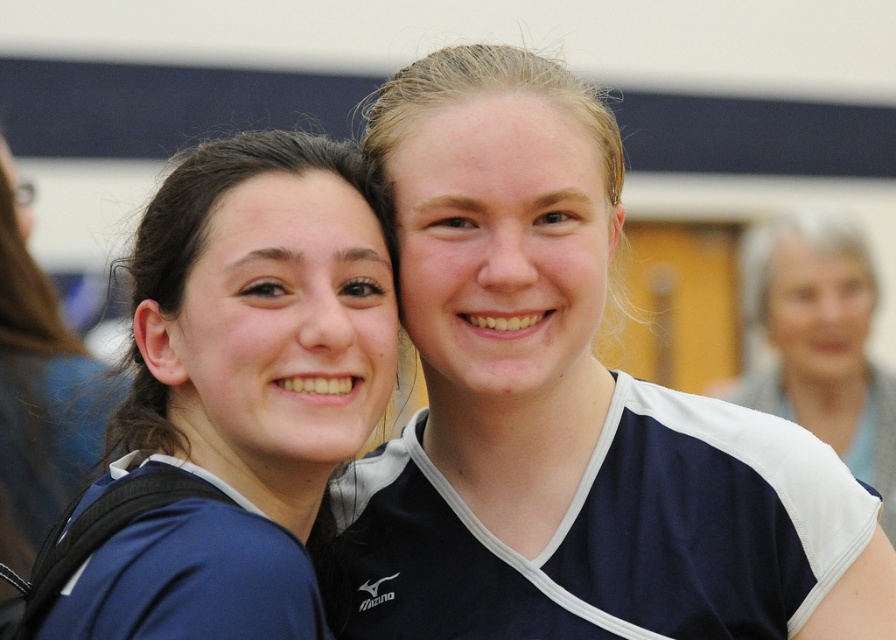
Question: Does blue jersey at left appear over blue jersey at upper right?

Choices:
 (A) yes
 (B) no

Answer: (B)

Question: Where is blue jersey at left located in relation to matte blue jersey at left in the image?

Choices:
 (A) left
 (B) right

Answer: (B)

Question: Which is farther from the blue jersey at upper right?

Choices:
 (A) matte blue jersey at left
 (B) blue jersey at left

Answer: (B)

Question: Which of the following is the farthest from the observer?

Choices:
 (A) (145, 396)
 (B) (850, 296)
 (C) (24, 525)

Answer: (B)

Question: Is blue jersey at upper right thinner than matte blue jersey at left?

Choices:
 (A) yes
 (B) no

Answer: (B)

Question: Which point is farther to the camera?

Choices:
 (A) blue jersey at left
 (B) matte blue jersey at left

Answer: (B)